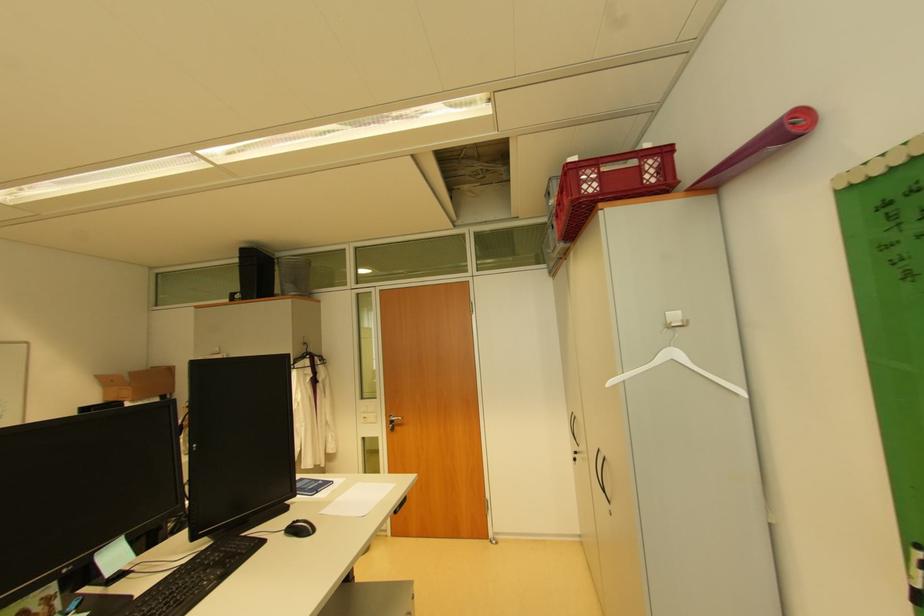
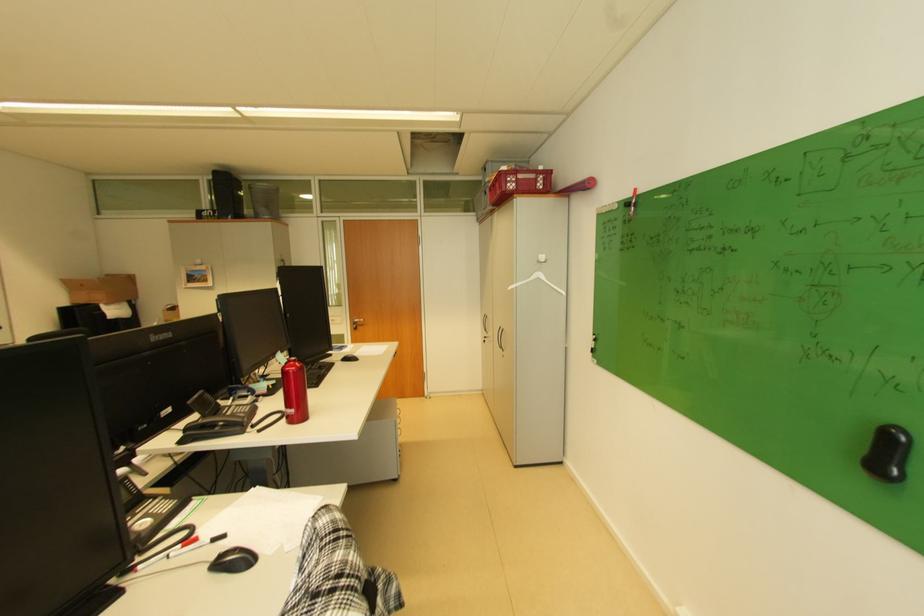
Find the pixel in the second image that matches the point at 681,361 in the first image.

(546, 278)